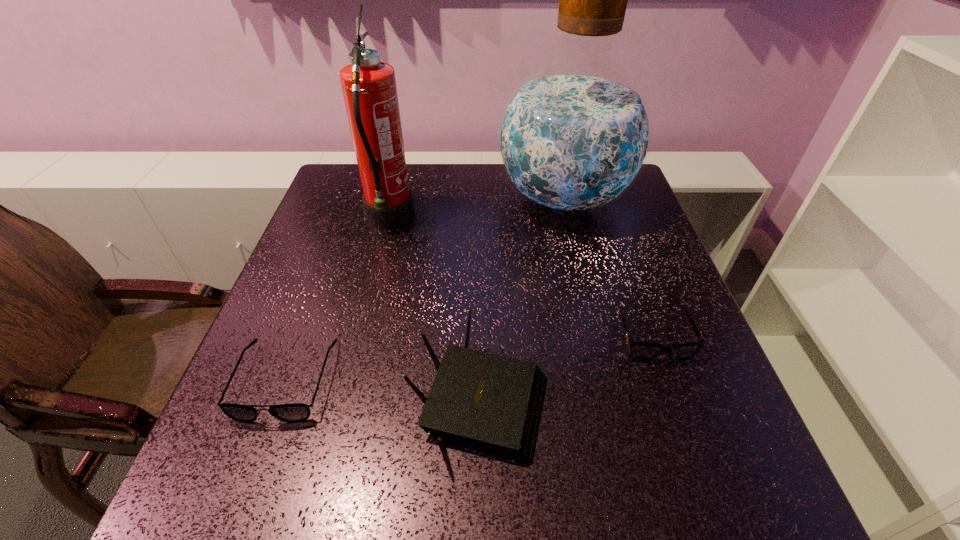
Identify the location of water jug. Image resolution: width=960 pixels, height=540 pixels. (574, 136).

Where is `fire extinguisher`? The image size is (960, 540). fire extinguisher is located at coordinates (369, 89).

Locate an element on the screen. Image resolution: width=960 pixels, height=540 pixels. router is located at coordinates (489, 403).

Identify the location of spectacles. The width and height of the screenshot is (960, 540). (295, 412).

The width and height of the screenshot is (960, 540). In order to click on sunglasses in this screenshot , I will do `click(641, 351)`.

The height and width of the screenshot is (540, 960). I want to click on vacant region located on the front of the water jug, so click(595, 331).

Locate an element on the screen. The image size is (960, 540). vacant region located 0.380m on the front-facing side of the fire extinguisher is located at coordinates (556, 221).

You are a GUI agent. You are given a task and a screenshot of the screen. Output one action in this format:
    pyautogui.click(x=<x>, y=<y>)
    Task: Click on the free space located 0.070m on the right of the third shortest object
    This screenshot has width=960, height=540.
    Given the screenshot: What is the action you would take?
    pyautogui.click(x=588, y=396)

Find the location of a particular element. The image size is (960, 540). free space located on the front-facing side of the spectacles is located at coordinates (243, 497).

In order to click on vacant space located on the front-facing side of the sunglasses in this screenshot , I will do `click(708, 493)`.